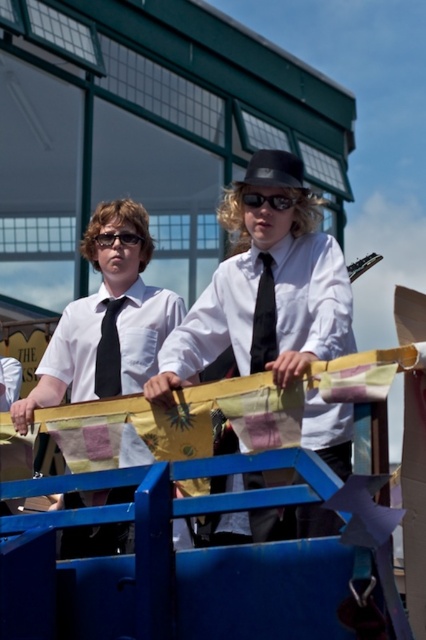
Question: Which point is closer to the camera taking this photo?

Choices:
 (A) (131, 285)
 (B) (267, 285)
 (C) (94, 365)

Answer: (B)

Question: Is black satin tie at center smaller than black matte tie at center?

Choices:
 (A) no
 (B) yes

Answer: (B)

Question: Can you confirm if black satin tie at center is smaller than black matte tie at center?

Choices:
 (A) no
 (B) yes

Answer: (B)

Question: Which object is farther from the camera taking this photo?

Choices:
 (A) matte black shirt at center
 (B) black matte tie at center
 (C) black satin tie at center

Answer: (B)

Question: Can you confirm if matte black shirt at center is positioned to the left of black satin tie at center?

Choices:
 (A) no
 (B) yes

Answer: (B)

Question: Which of the following is the closest to the observer?

Choices:
 (A) black matte tie at center
 (B) black satin tie at center

Answer: (B)